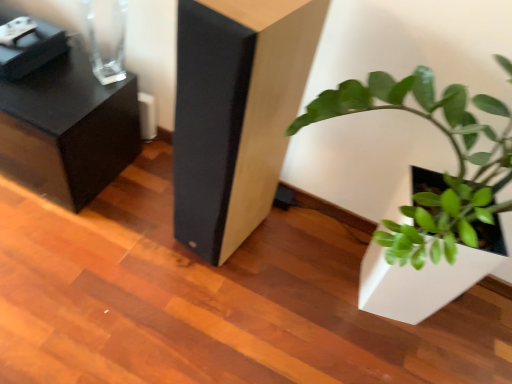
Question: Do you think green matte plant at lower right is within black textured side table at upper left, which appears as the first furniture when viewed from the left, or outside of it?

Choices:
 (A) inside
 (B) outside

Answer: (B)

Question: From a real-world perspective, is green matte plant at lower right above or below black textured side table at upper left, which appears as the first furniture when viewed from the left?

Choices:
 (A) above
 (B) below

Answer: (A)

Question: Considering the real-world distances, which object is farthest from the green matte plant at lower right?

Choices:
 (A) matte black speaker at center, marked as the 1th furniture in a right-to-left arrangement
 (B) black textured side table at upper left, the second furniture from the right

Answer: (B)

Question: Considering the real-world distances, which object is farthest from the green matte plant at lower right?

Choices:
 (A) matte black speaker at center, placed as the second furniture when sorted from left to right
 (B) black textured side table at upper left, which appears as the first furniture when viewed from the left

Answer: (B)